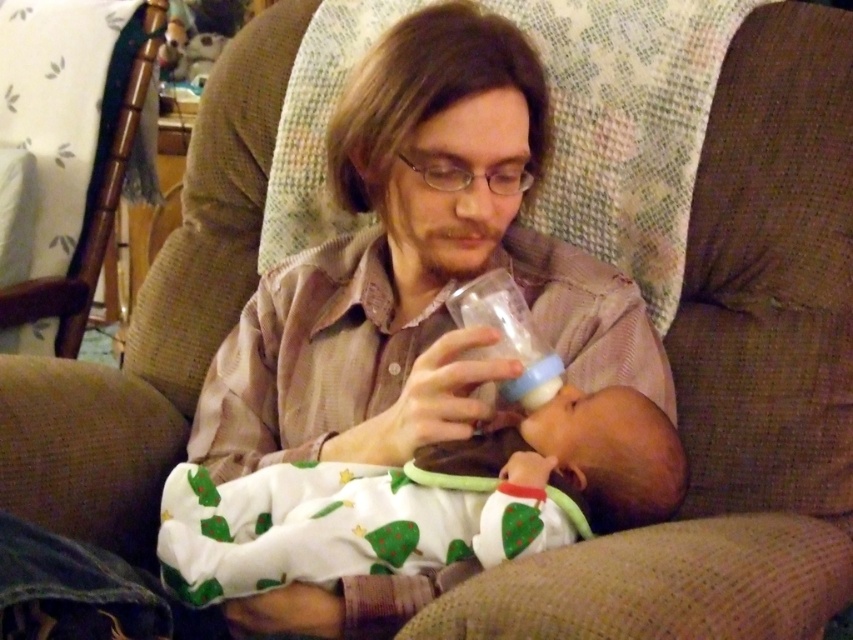
Who is lower down, white soft fabric baby at center or transparent plastic bottle at center?

white soft fabric baby at center

Is point (569, 477) more distant than point (550, 378)?

No, (569, 477) is closer to viewer.

Find the location of `white soft fabric baby at center`. white soft fabric baby at center is located at coordinates (424, 500).